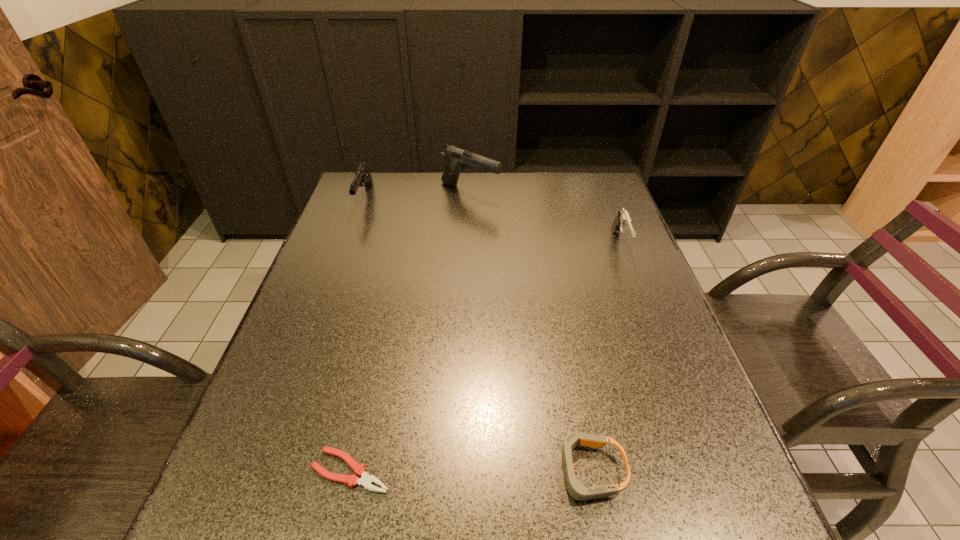
Find the location of a particular element. free space located at the end of the barrel of the leftmost gun is located at coordinates (332, 289).

In order to click on free space located at the muzzle of the rightmost gun in this screenshot , I will do `click(646, 312)`.

I want to click on blank area located on the front and back of the goggles, so click(332, 471).

Identify the location of free space located on the front and back of the goggles. The width and height of the screenshot is (960, 540). (495, 471).

I want to click on vacant space located 0.220m on the front and back of the goggles, so click(x=425, y=471).

At what (x,y) coordinates should I click in order to perform the action: click on vacant space located on the right of the fourth object from right to left. Please return your answer as a coordinate pair (x, y). The image size is (960, 540). Looking at the image, I should click on (595, 471).

Where is `object that is at the near edge`? The width and height of the screenshot is (960, 540). object that is at the near edge is located at coordinates (576, 489).

Identify the location of gun present at the left edge. This screenshot has width=960, height=540. (363, 177).

At what (x,y) coordinates should I click in order to perform the action: click on pliers that is at the left edge. Please return your answer as a coordinate pair (x, y). The height and width of the screenshot is (540, 960). Looking at the image, I should click on (366, 480).

The image size is (960, 540). I want to click on object at the right edge, so click(622, 223).